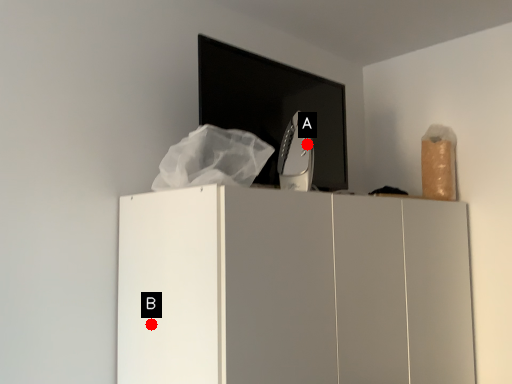
Question: Two points are circled on the image, labeled by A and B beside each circle. Which of the following is the farthest from the observer?

Choices:
 (A) A is further
 (B) B is further

Answer: (A)